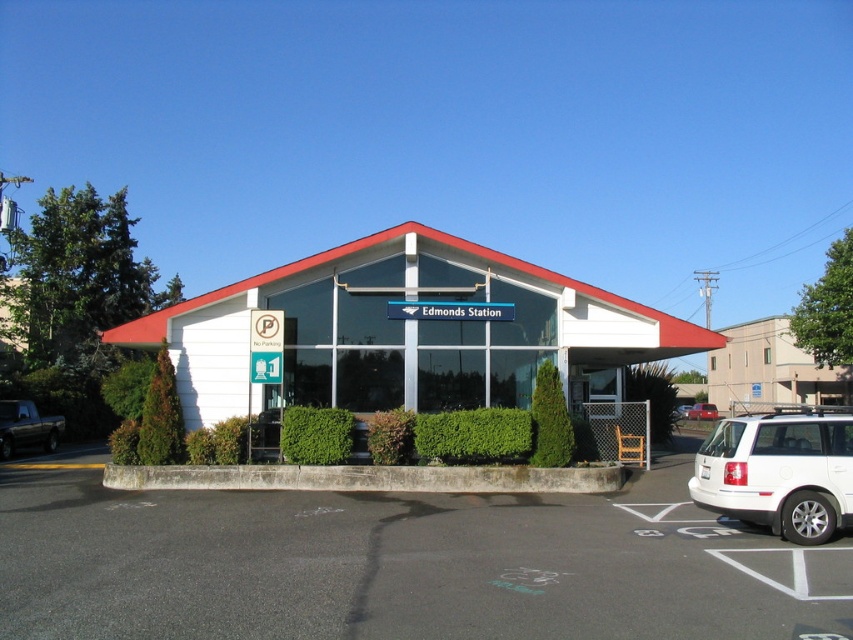
You are a delivery driver arriving at Edmonds Station. You need to park your vehicle but see the white matte suv at lower right and the metallic silver sedan at center. Which vehicle is blocking your path to the parking spot closest to the entrance?

The white matte suv at lower right is in front of the metallic silver sedan at center, so it is blocking the path to the parking spot closest to the entrance.